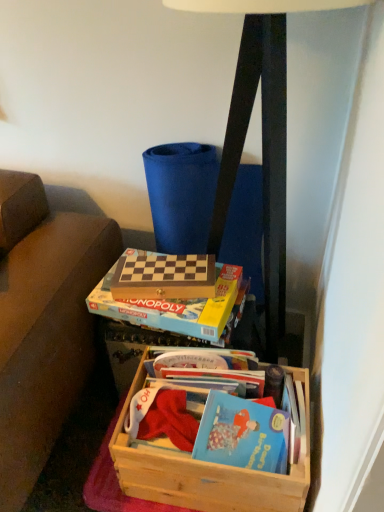
The image size is (384, 512). Find the location of `vacant space in front of wooden board game at center, the 1th paperback book in the back-to-front sequence`. vacant space in front of wooden board game at center, the 1th paperback book in the back-to-front sequence is located at coordinates (168, 309).